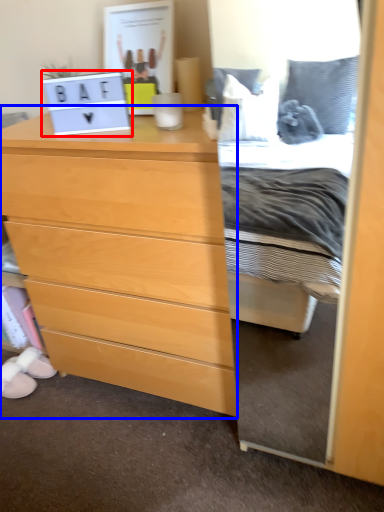
Question: Which object appears closest to the camera in this image, laptop (highlighted by a red box) or chest of drawers (highlighted by a blue box)?

Choices:
 (A) laptop
 (B) chest of drawers

Answer: (B)